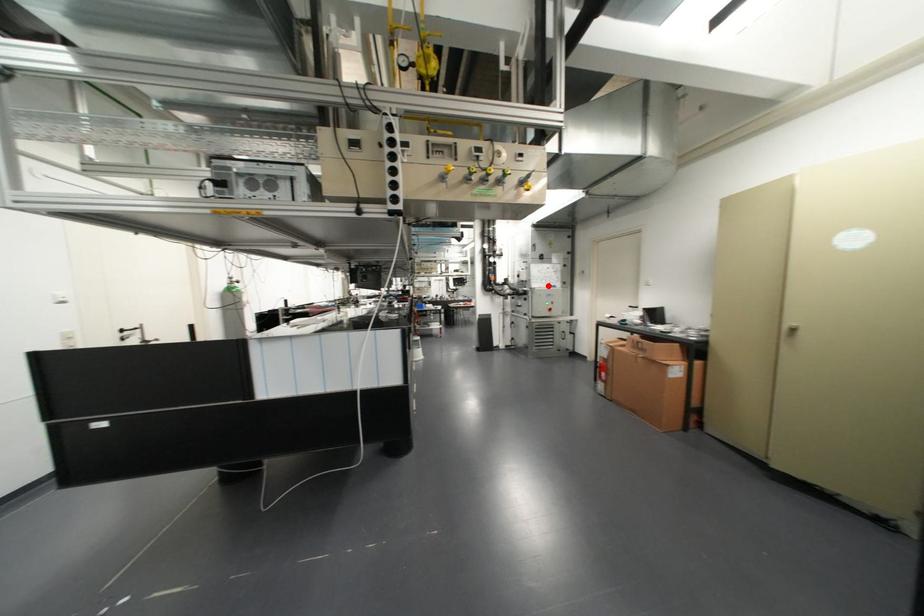
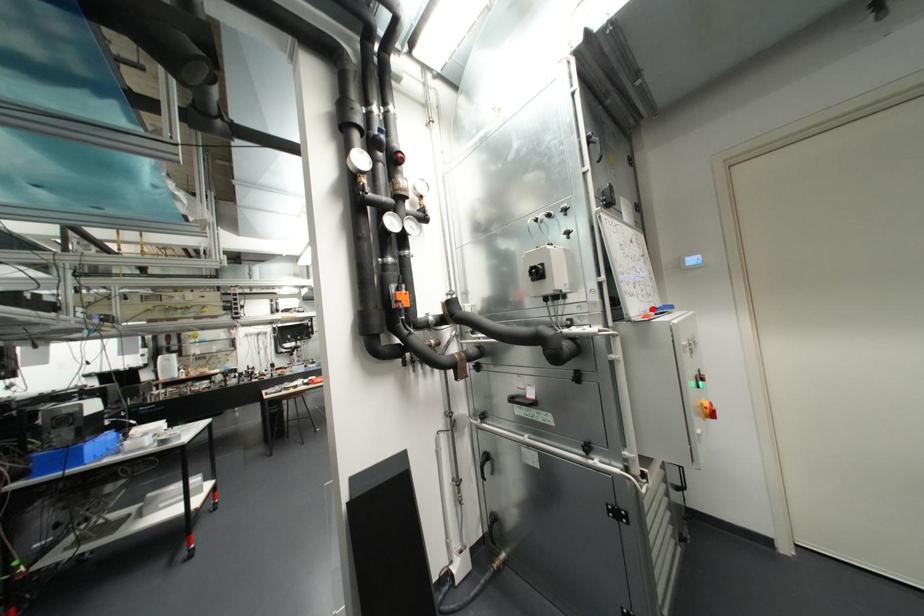
I am providing you with two images of the same scene from different viewpoints. A red point is marked on the first image and another point is marked on the second image. Do the highlighted points in image1 and image2 indicate the same real-world spot?

Yes